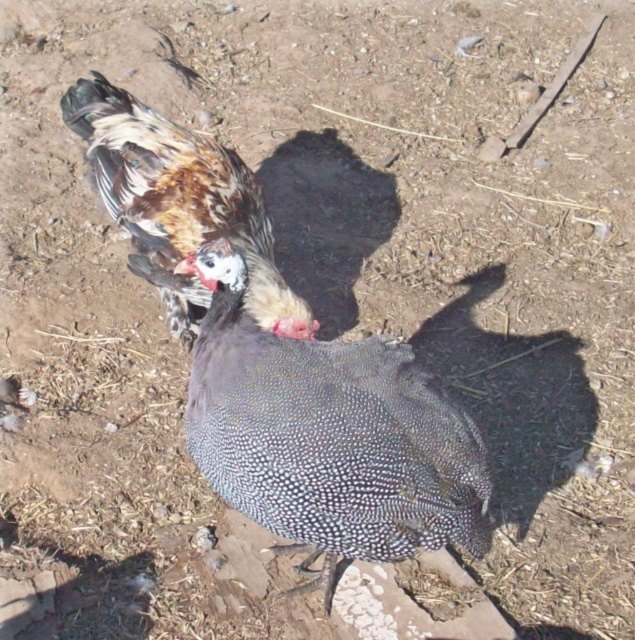
You are a farmer looking at the image of two birds on the ground. You notice a white speckled feather at center and a speckled feathered chicken at center. Which object is smaller in size?

The white speckled feather at center is smaller in size compared to the speckled feathered chicken at center.

You are standing in front of the birds and want to throw a seed to the bird that is closer to you. Which point should you aim for, point (331,397) or point (197,157)?

You should aim for point (331,397) because it is closer to the viewer than point (197,157).

You are standing at the camera position and want to place a 2.5 meter long fence between you and the point at point (391, 554). Will the fence reach the point?

The distance between you and the point at point (391, 554) is 1.86 meters. Since the fence is 2.5 meters long, it will extend beyond the point by 0.64 meters.